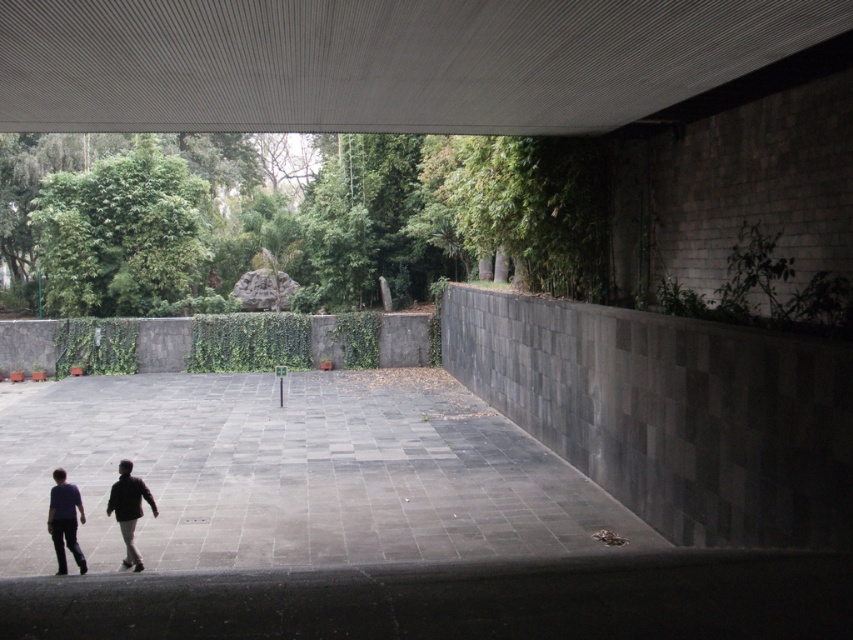
You are standing under an overhang and see a gray stone path at center and dark gray pants at lower left. Which object is positioned to the left of the other?

The gray stone path at center is to the left of dark gray pants at lower left.